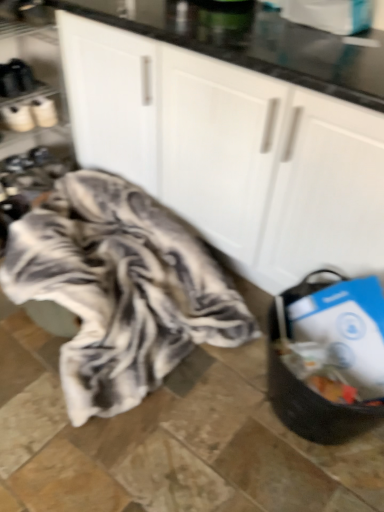
Question: In the image, is fluffy white blanket at center positioned in front of or behind black matte shoe rack at left?

Choices:
 (A) behind
 (B) front

Answer: (B)

Question: Does point (104, 225) appear closer or farther from the camera than point (49, 58)?

Choices:
 (A) closer
 (B) farther

Answer: (A)

Question: Which of these objects is positioned closest to the white matte cabinet at center?

Choices:
 (A) fluffy white blanket at center
 (B) black matte shoe rack at left

Answer: (A)

Question: Estimate the real-world distances between objects in this image. Which object is closer to the black matte shoe rack at left?

Choices:
 (A) fluffy white blanket at center
 (B) white matte cabinet at center

Answer: (A)